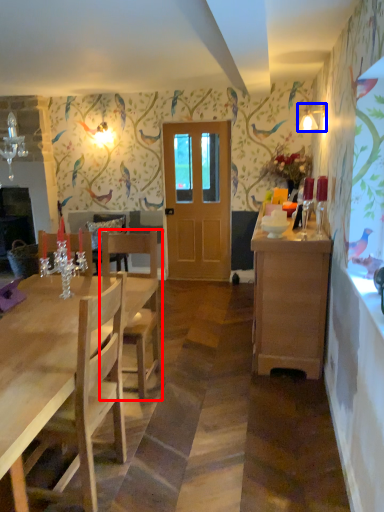
Question: Which point is further to the camera, chair (highlighted by a red box) or lamp (highlighted by a blue box)?

Choices:
 (A) chair
 (B) lamp

Answer: (B)